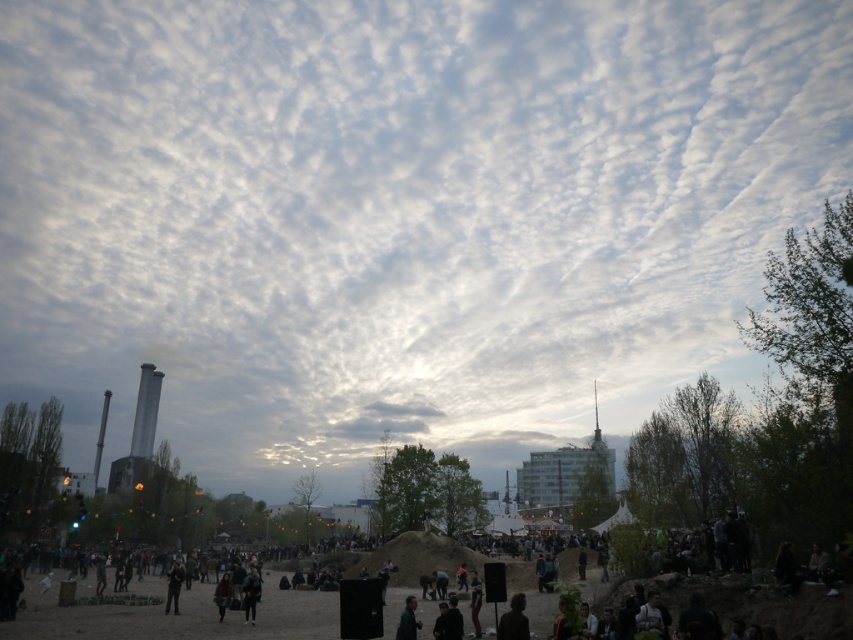
You are a photographer trying to capture a photo of the dark clothing at center and the dark gray fabric jacket at center. You want to ensure both subjects are in focus. Given that your camera has a depth of field that can cover 50 feet, will you be able to achieve this?

The dark clothing at center is 50.58 feet from the dark gray fabric jacket at center. Since the distance between them exceeds the camera depth of field of 50 feet, you will not be able to have both subjects in focus simultaneously.

You are standing at the edge of the sandy area and want to find the dark clothing at center. According to the coordinates provided, in which direction should you look relative to your current position?

The dark clothing at center is located at point 0.961 on the x axis and 0.202 on the y axis. Since you are at the edge of the sandy area, you should look towards the center of the scene to find it.